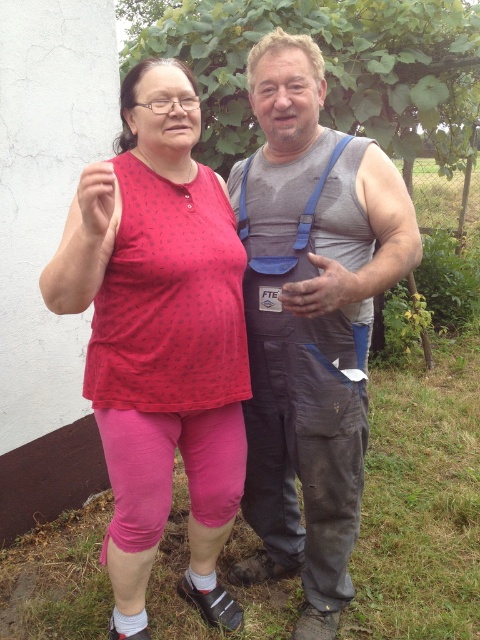
Question: Is matte pink leggings at left closer to the viewer compared to gray fabric tank top at center?

Choices:
 (A) yes
 (B) no

Answer: (A)

Question: Among these points, which one is nearest to the camera?

Choices:
 (A) (191, 374)
 (B) (331, 173)

Answer: (A)

Question: Is matte pink leggings at left positioned at the back of gray fabric tank top at center?

Choices:
 (A) yes
 (B) no

Answer: (B)

Question: From the image, what is the correct spatial relationship of matte pink leggings at left in relation to gray fabric tank top at center?

Choices:
 (A) right
 (B) left

Answer: (B)